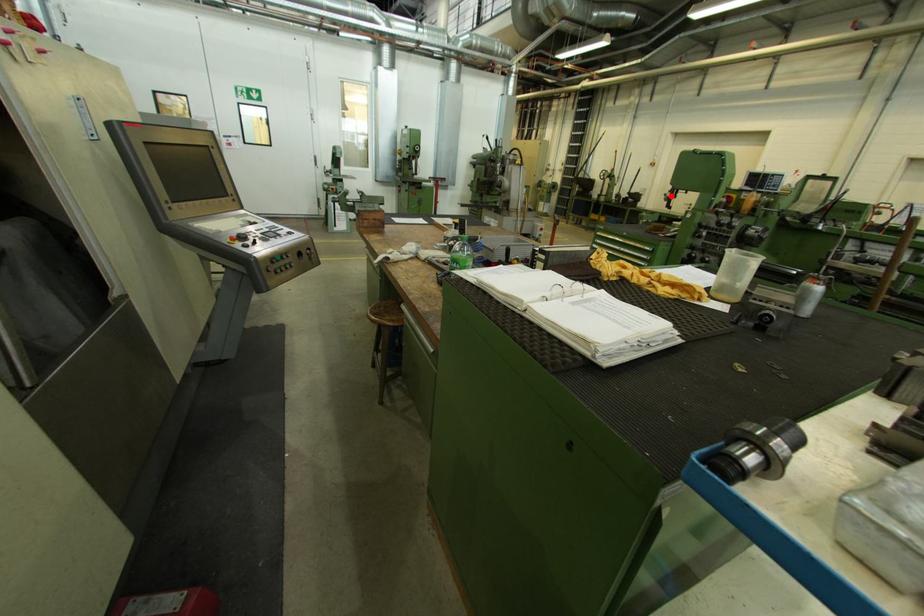
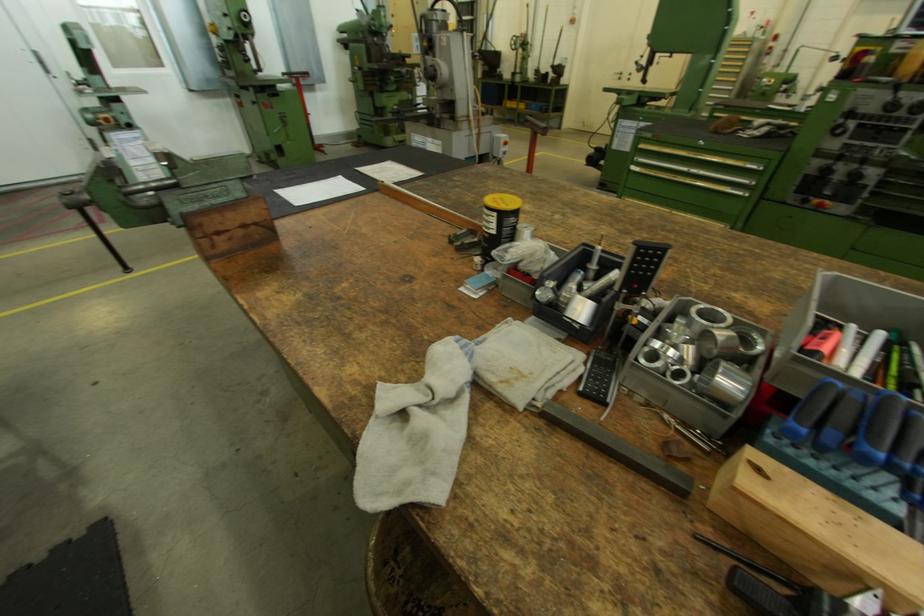
Question: I am providing you with two images of the same scene from different viewpoints. Given a red point in image1, look at the same physical point in image2. Is it:

Choices:
 (A) Closer to the viewpoint
 (B) Farther from the viewpoint

Answer: (B)